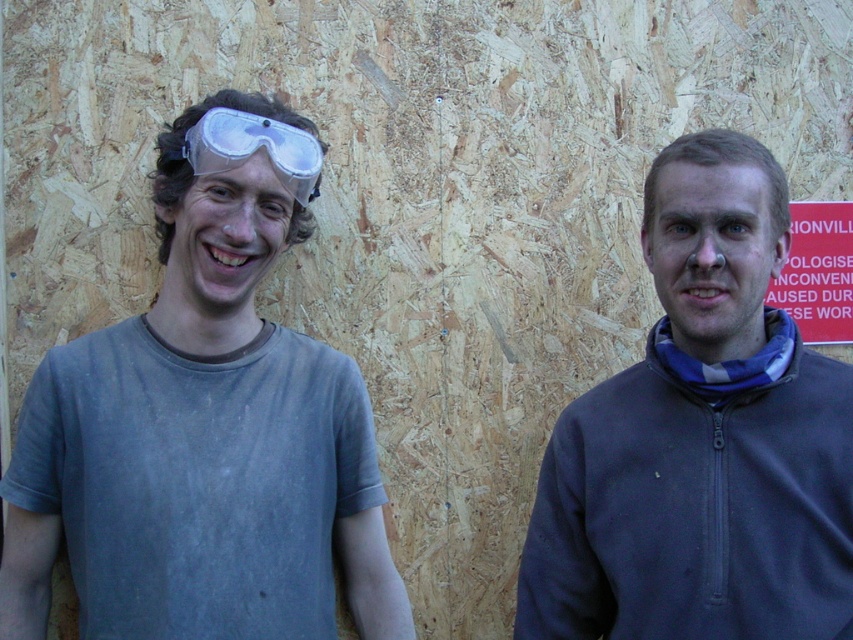
Question: Can you confirm if red plastic sign at right is bigger than transparent plastic goggles at left?

Choices:
 (A) yes
 (B) no

Answer: (B)

Question: Estimate the real-world distances between objects in this image. Which object is closer to the transparent plastic goggles at left?

Choices:
 (A) gray matte t-shirt at left
 (B) red plastic sign at right

Answer: (A)

Question: Estimate the real-world distances between objects in this image. Which object is farther from the gray matte t-shirt at left?

Choices:
 (A) dark gray fleece at right
 (B) red plastic sign at right
 (C) transparent plastic goggles at left

Answer: (B)

Question: Is gray matte t-shirt at left smaller than transparent plastic goggles at left?

Choices:
 (A) no
 (B) yes

Answer: (A)

Question: Is dark gray fleece at right wider than transparent plastic goggles at left?

Choices:
 (A) yes
 (B) no

Answer: (A)

Question: Which of the following is the farthest from the observer?

Choices:
 (A) (180, 298)
 (B) (785, 284)
 (C) (828, 550)

Answer: (B)